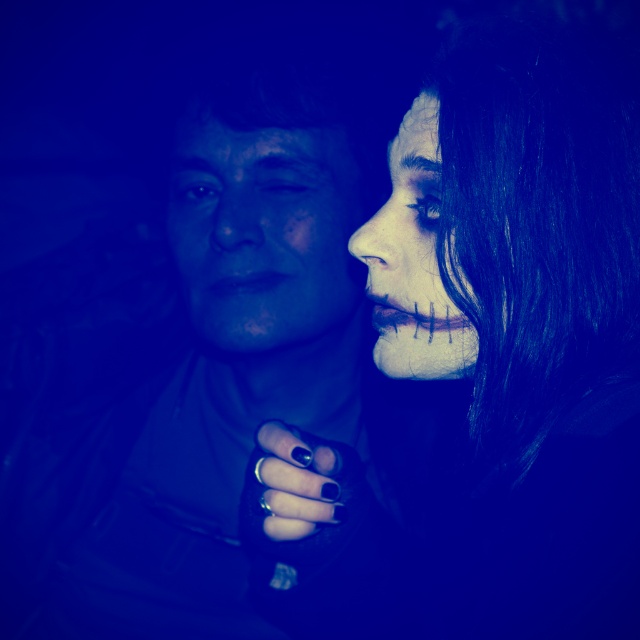
You are an artist planning to paint a portrait of the scene. You need to decide which object to focus on first based on their sizes. Which object should you start with, the matte black jacket at center or the matte white face at right?

The matte black jacket at center is larger in size than the matte white face at right, so you should start with the matte black jacket at center as it requires more attention due to its larger size.